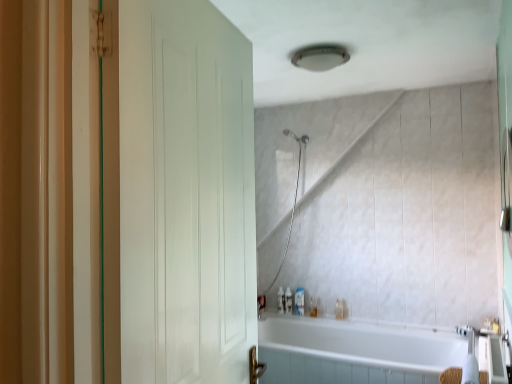
Question: Is translucent plastic soap dispenser at lower center, placed as the fifth toiletry when sorted from right to left, positioned behind translucent plastic soap dispenser at lower center, the fourth toiletry positioned from the right?

Choices:
 (A) yes
 (B) no

Answer: (A)

Question: Is translucent plastic soap dispenser at lower center, placed as the fifth toiletry when sorted from right to left, positioned with its back to translucent plastic soap dispenser at lower center, the fourth toiletry positioned from the right?

Choices:
 (A) no
 (B) yes

Answer: (A)

Question: From a real-world perspective, is translucent plastic soap dispenser at lower center, placed as the fifth toiletry when sorted from right to left, on top of translucent plastic soap dispenser at lower center, the fourth toiletry positioned from the right?

Choices:
 (A) yes
 (B) no

Answer: (B)

Question: Can you confirm if translucent plastic soap dispenser at lower center, placed as the fifth toiletry when sorted from right to left, is taller than translucent plastic soap dispenser at lower center, arranged as the 3th toiletry when viewed from the left?

Choices:
 (A) no
 (B) yes

Answer: (A)

Question: From the image's perspective, is translucent plastic soap dispenser at lower center, placed as the fifth toiletry when sorted from right to left, over translucent plastic soap dispenser at lower center, arranged as the 3th toiletry when viewed from the left?

Choices:
 (A) no
 (B) yes

Answer: (A)

Question: From the image's perspective, is translucent plastic bottle at lower center, positioned as the sixth toiletry in left-to-right order, located above or below translucent plastic bottle at lower center, placed as the 6th toiletry when sorted from right to left?

Choices:
 (A) above
 (B) below

Answer: (A)

Question: Is translucent plastic bottle at lower center, positioned as the sixth toiletry in left-to-right order, taller or shorter than translucent plastic bottle at lower center, placed as the 6th toiletry when sorted from right to left?

Choices:
 (A) tall
 (B) short

Answer: (A)

Question: In the image, is translucent plastic bottle at lower center, the 1th toiletry positioned from the right, positioned in front of or behind translucent plastic bottle at lower center, placed as the first toiletry when sorted from left to right?

Choices:
 (A) behind
 (B) front

Answer: (B)

Question: Looking at their shapes, would you say translucent plastic bottle at lower center, positioned as the sixth toiletry in left-to-right order, is wider or thinner than translucent plastic bottle at lower center, placed as the 6th toiletry when sorted from right to left?

Choices:
 (A) wide
 (B) thin

Answer: (A)

Question: Is white glossy bathtub at lower center wider or thinner than translucent plastic soap dispenser at lower center, placed as the fifth toiletry when sorted from right to left?

Choices:
 (A) thin
 (B) wide

Answer: (B)

Question: Relative to translucent plastic soap dispenser at lower center, placed as the fifth toiletry when sorted from right to left, is white glossy bathtub at lower center in front or behind?

Choices:
 (A) behind
 (B) front

Answer: (B)

Question: Visually, is white glossy bathtub at lower center positioned to the left or to the right of translucent plastic soap dispenser at lower center, positioned as the second toiletry in left-to-right order?

Choices:
 (A) left
 (B) right

Answer: (B)

Question: From the image's perspective, is white glossy bathtub at lower center positioned above or below translucent plastic soap dispenser at lower center, positioned as the second toiletry in left-to-right order?

Choices:
 (A) above
 (B) below

Answer: (B)

Question: Considering the positions of point (260, 301) and point (185, 117), is point (260, 301) closer or farther from the camera than point (185, 117)?

Choices:
 (A) closer
 (B) farther

Answer: (B)

Question: Considering the positions of translucent plastic bottle at lower center, placed as the first toiletry when sorted from left to right, and white matte door at left in the image, is translucent plastic bottle at lower center, placed as the first toiletry when sorted from left to right, bigger or smaller than white matte door at left?

Choices:
 (A) big
 (B) small

Answer: (B)